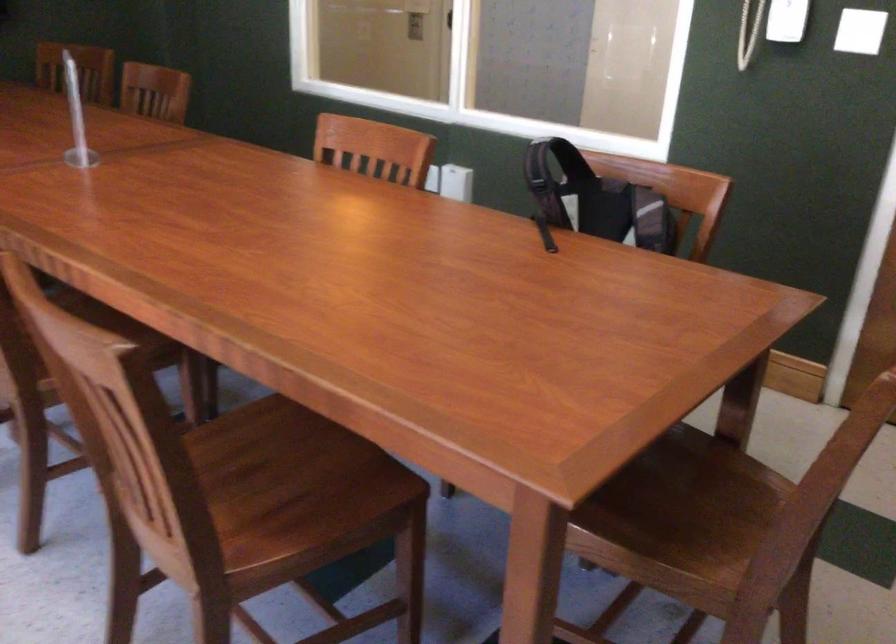
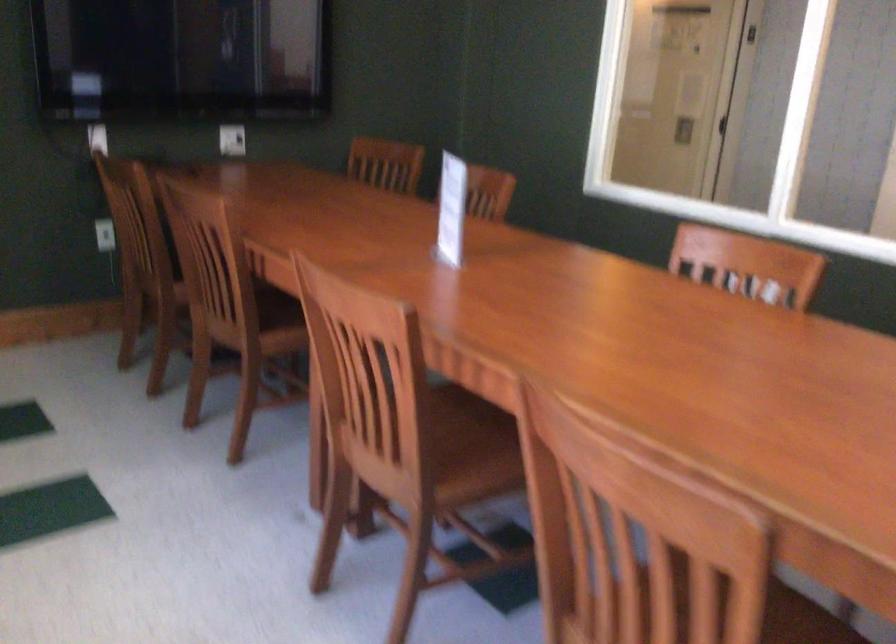
Question: How did the camera likely rotate?

Choices:
 (A) Left
 (B) Right
 (C) Up
 (D) Down

Answer: (A)